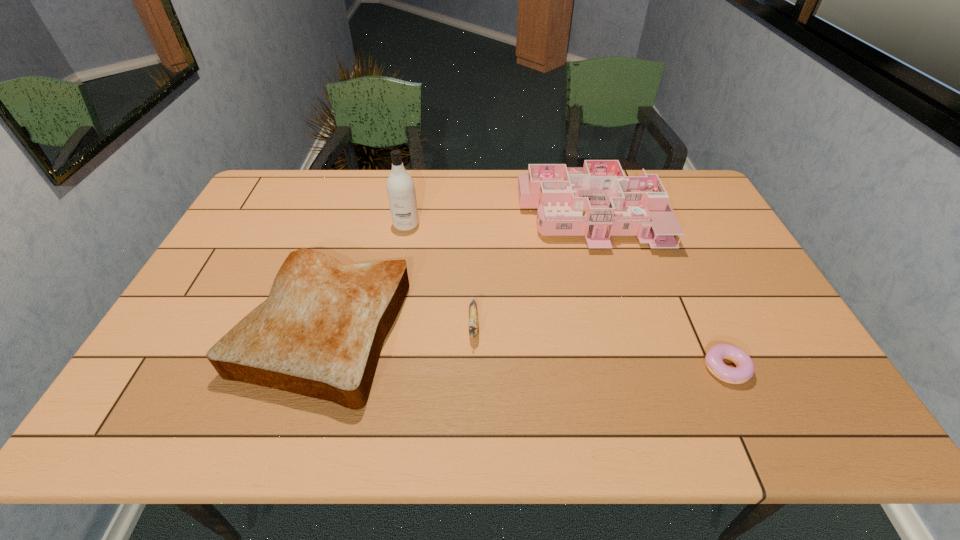
The image size is (960, 540). Find the location of `free space between the dollhouse and the banana`. free space between the dollhouse and the banana is located at coordinates (531, 269).

Locate an element on the screen. This screenshot has height=540, width=960. vacant space in between the doughnut and the shampoo is located at coordinates (565, 296).

I want to click on empty location between the shampoo and the doughnut, so click(565, 296).

Locate an element on the screen. vacant area that lies between the bread and the doughnut is located at coordinates (524, 348).

The image size is (960, 540). I want to click on vacant space that's between the banana and the dollhouse, so click(x=531, y=269).

Locate an element on the screen. The height and width of the screenshot is (540, 960). vacant area that lies between the shortest object and the third tallest object is located at coordinates (524, 348).

This screenshot has width=960, height=540. In order to click on unoccupied position between the doughnut and the bread in this screenshot , I will do `click(524, 348)`.

You are a GUI agent. You are given a task and a screenshot of the screen. Output one action in this format:
    pyautogui.click(x=<x>, y=<y>)
    Task: Click on the object identified as the second closest to the shortest object
    
    Given the screenshot: What is the action you would take?
    pyautogui.click(x=472, y=314)

Select which object is the second closest to the second shortest object. Please provide its 2D coordinates. Your answer should be formatted as a tuple, i.e. [(x, y)], where the tuple contains the x and y coordinates of a point satisfying the conditions above.

[(598, 198)]

Locate an element on the screen. The height and width of the screenshot is (540, 960). free space that satisfies the following two spatial constraints: 1. at the front entrance of the dollhouse; 2. on the left side of the doughnut is located at coordinates (633, 368).